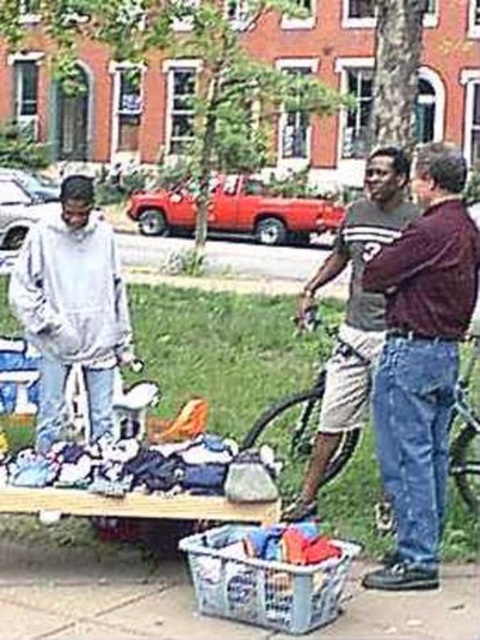
Question: Estimate the real-world distances between objects in this image. Which object is closer to the maroon fabric shirt at right?

Choices:
 (A) white cotton clothes at center
 (B) gray cotton t-shirt at center

Answer: (A)

Question: Which point is closer to the camera taking this photo?

Choices:
 (A) (444, 365)
 (B) (130, 465)

Answer: (A)

Question: Based on their relative distances, which object is nearer to the white cotton clothes at center?

Choices:
 (A) plastic crate at lower center
 (B) gray cotton t-shirt at center
 (C) light gray hoodie at left

Answer: (A)

Question: Is plastic crate at lower center bigger than white cotton clothes at center?

Choices:
 (A) no
 (B) yes

Answer: (B)

Question: Can you confirm if plastic crate at lower center is positioned to the right of white cotton clothes at center?

Choices:
 (A) yes
 (B) no

Answer: (A)

Question: Can you confirm if maroon fabric shirt at right is wider than white cotton clothes at center?

Choices:
 (A) no
 (B) yes

Answer: (A)